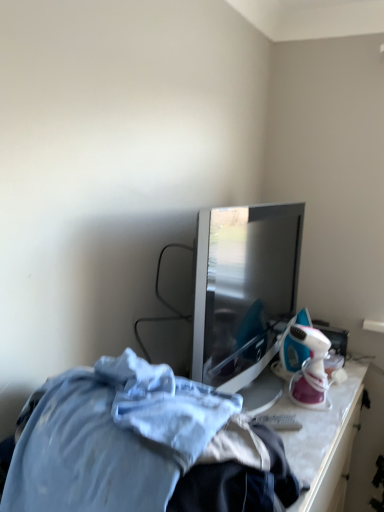
What do you see at coordinates (85, 455) in the screenshot? I see `white fabric at lower left` at bounding box center [85, 455].

Where is `white fabric at lower left`? This screenshot has width=384, height=512. white fabric at lower left is located at coordinates (85, 455).

Identify the location of white fabric at lower left. (85, 455).